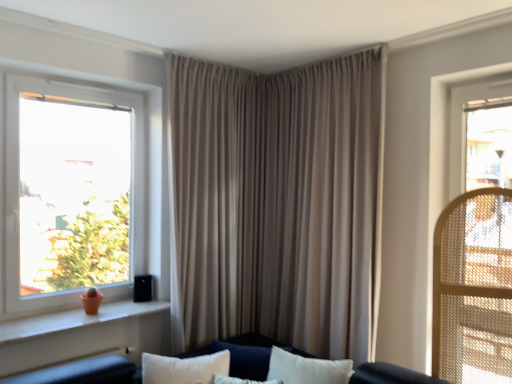
Question: Is beige fabric curtain at center not near white plastic window at left?

Choices:
 (A) no
 (B) yes

Answer: (A)

Question: Is beige fabric curtain at center oriented towards white plastic window at left?

Choices:
 (A) yes
 (B) no

Answer: (A)

Question: Does beige fabric curtain at center appear on the left side of white plastic window at left?

Choices:
 (A) yes
 (B) no

Answer: (B)

Question: Is white plastic window at left inside beige fabric curtain at center?

Choices:
 (A) no
 (B) yes

Answer: (A)

Question: From a real-world perspective, is beige fabric curtain at center below white plastic window at left?

Choices:
 (A) yes
 (B) no

Answer: (A)

Question: From a real-world perspective, is orange clay pot at left physically located above or below beige fabric curtain at center?

Choices:
 (A) below
 (B) above

Answer: (A)

Question: Is orange clay pot at left to the left or to the right of beige fabric curtain at center in the image?

Choices:
 (A) right
 (B) left

Answer: (B)

Question: Is orange clay pot at left bigger or smaller than beige fabric curtain at center?

Choices:
 (A) small
 (B) big

Answer: (A)

Question: In terms of height, does orange clay pot at left look taller or shorter compared to beige fabric curtain at center?

Choices:
 (A) short
 (B) tall

Answer: (A)

Question: Considering the positions of white plastic window at left and beige fabric curtain at center in the image, is white plastic window at left bigger or smaller than beige fabric curtain at center?

Choices:
 (A) big
 (B) small

Answer: (B)

Question: In the image, is white plastic window at left positioned in front of or behind beige fabric curtain at center?

Choices:
 (A) behind
 (B) front

Answer: (B)

Question: Considering the relative positions of white plastic window at left and beige fabric curtain at center in the image provided, is white plastic window at left to the left or to the right of beige fabric curtain at center?

Choices:
 (A) left
 (B) right

Answer: (A)

Question: From a real-world perspective, relative to beige fabric curtain at center, is white plastic window at left vertically above or below?

Choices:
 (A) above
 (B) below

Answer: (A)

Question: Considering the relative positions of velvet dark blue couch at center and orange clay pot at left in the image provided, is velvet dark blue couch at center to the left or to the right of orange clay pot at left?

Choices:
 (A) right
 (B) left

Answer: (A)

Question: Is velvet dark blue couch at center in front of or behind orange clay pot at left in the image?

Choices:
 (A) behind
 (B) front

Answer: (B)